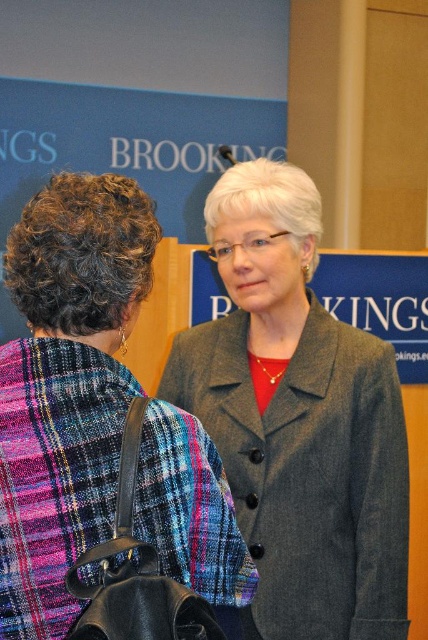
Question: Which object appears farthest from the camera in this image?

Choices:
 (A) dark gray woolen coat at center
 (B) matte gray blazer at center

Answer: (A)

Question: Does matte gray blazer at center appear on the left side of dark gray woolen coat at center?

Choices:
 (A) yes
 (B) no

Answer: (A)

Question: Is matte gray blazer at center closer to the viewer compared to dark gray woolen coat at center?

Choices:
 (A) no
 (B) yes

Answer: (B)

Question: Does matte gray blazer at center appear over dark gray woolen coat at center?

Choices:
 (A) no
 (B) yes

Answer: (B)

Question: Which point is farther to the camera?

Choices:
 (A) (44, 296)
 (B) (285, 634)

Answer: (B)

Question: Among these objects, which one is nearest to the camera?

Choices:
 (A) dark gray woolen coat at center
 (B) matte gray blazer at center

Answer: (B)